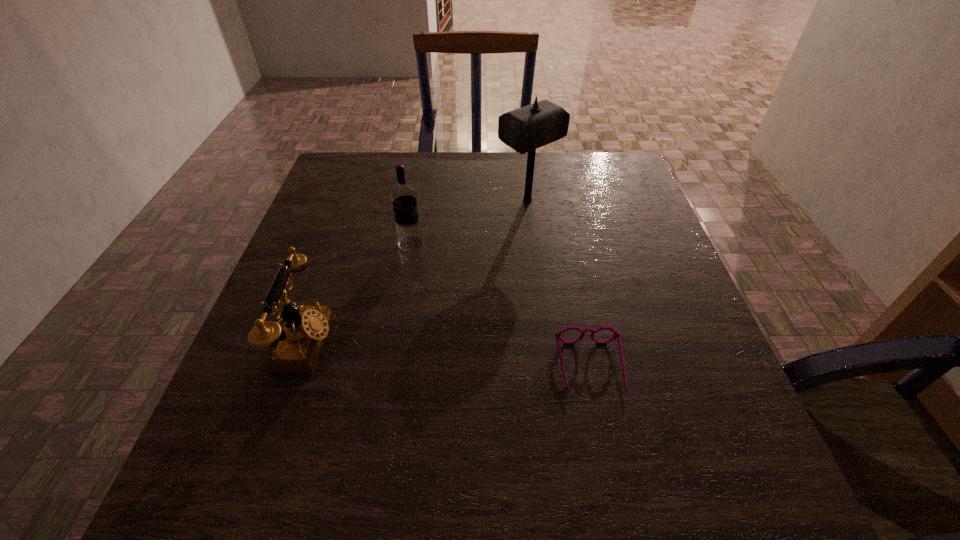
The image size is (960, 540). Identify the location of vacant space that satisfies the following two spatial constraints: 1. on the front side of the mallet; 2. on the dial of the telephone. (545, 342).